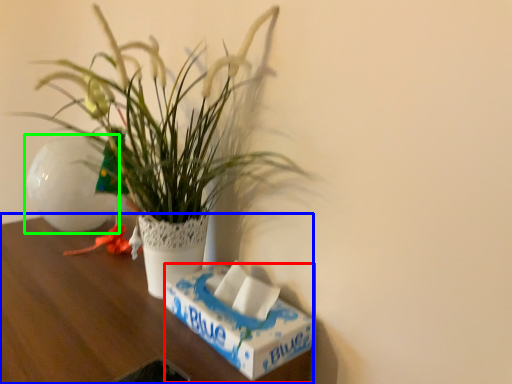
Question: Which object is positioned closest to box (highlighted by a red box)? Select from table (highlighted by a blue box) and flowerpot (highlighted by a green box).

Choices:
 (A) table
 (B) flowerpot

Answer: (A)